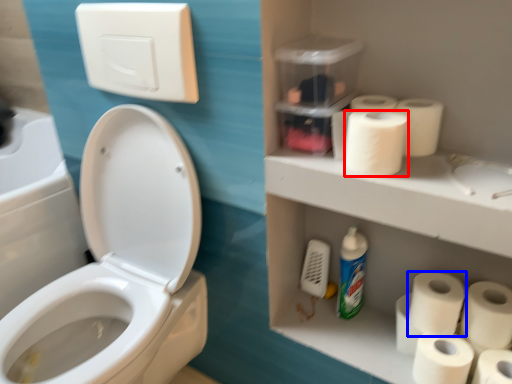
Question: Which object is further to the camera taking this photo, toilet paper (highlighted by a red box) or toilet paper (highlighted by a blue box)?

Choices:
 (A) toilet paper
 (B) toilet paper

Answer: (B)